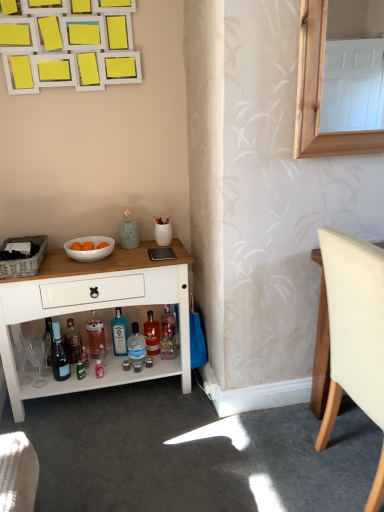
Where is `vacant area located to the right-hand side of white glossy bowl at center`? vacant area located to the right-hand side of white glossy bowl at center is located at coordinates (138, 258).